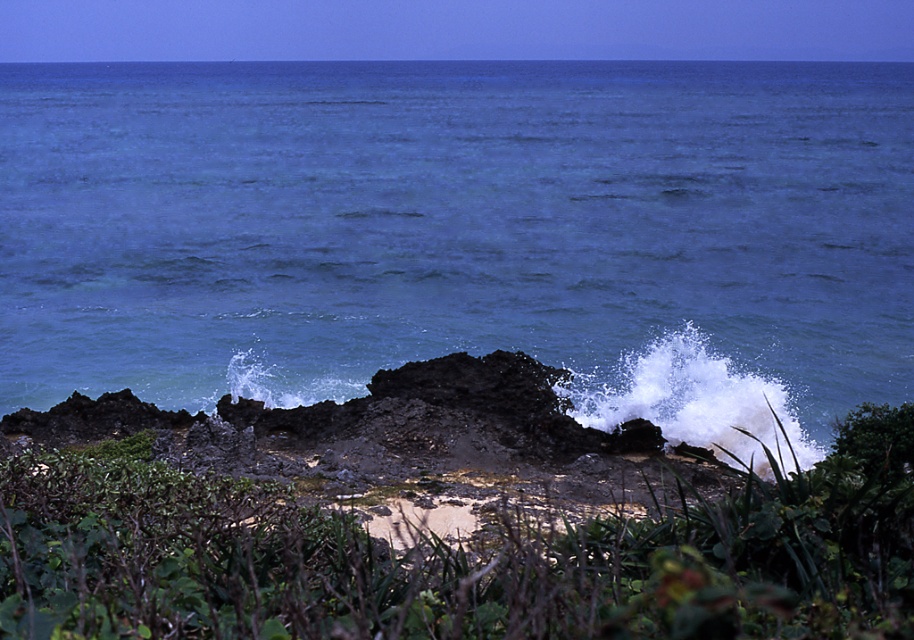
Question: Which point is closer to the camera?

Choices:
 (A) (347, 212)
 (B) (130, 522)

Answer: (B)

Question: Which point appears farthest from the camera in this image?

Choices:
 (A) (424, 576)
 (B) (891, 186)

Answer: (B)

Question: Does blue water at center have a larger size compared to green leafy vegetation at center?

Choices:
 (A) no
 (B) yes

Answer: (B)

Question: Is blue water at center closer to camera compared to green leafy vegetation at center?

Choices:
 (A) no
 (B) yes

Answer: (A)

Question: Among these objects, which one is nearest to the camera?

Choices:
 (A) blue water at center
 (B) green leafy vegetation at center

Answer: (B)

Question: Is blue water at center closer to the viewer compared to green leafy vegetation at center?

Choices:
 (A) yes
 (B) no

Answer: (B)